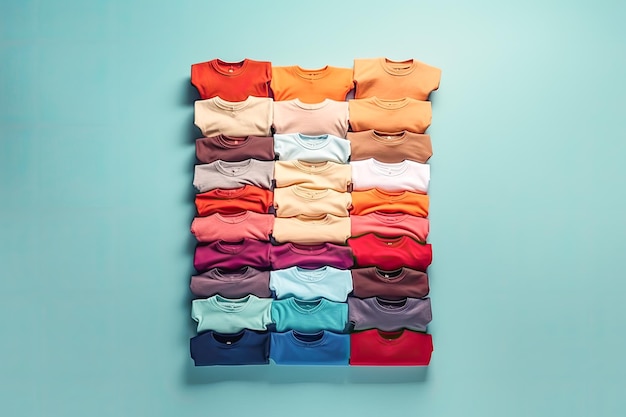
This screenshot has height=417, width=626. I want to click on folded shirts in the center column, so click(312, 81), click(313, 115), click(313, 150), click(313, 172), click(313, 201), click(313, 225), click(313, 254), click(315, 278), click(315, 313), click(316, 342).